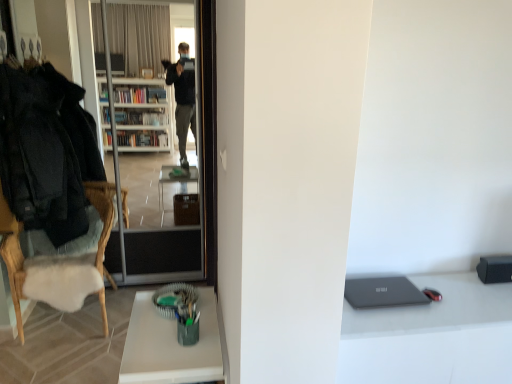
At what (x,y) coordinates should I click in order to perform the action: click on vacant region above satin black laptop at right (from a real-world perspective). Please return your answer as a coordinate pair (x, y). Looking at the image, I should click on (435, 303).